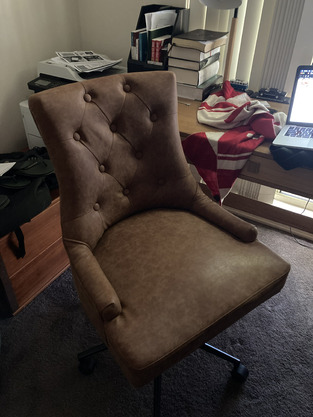
I want to click on floor, so click(262, 387).